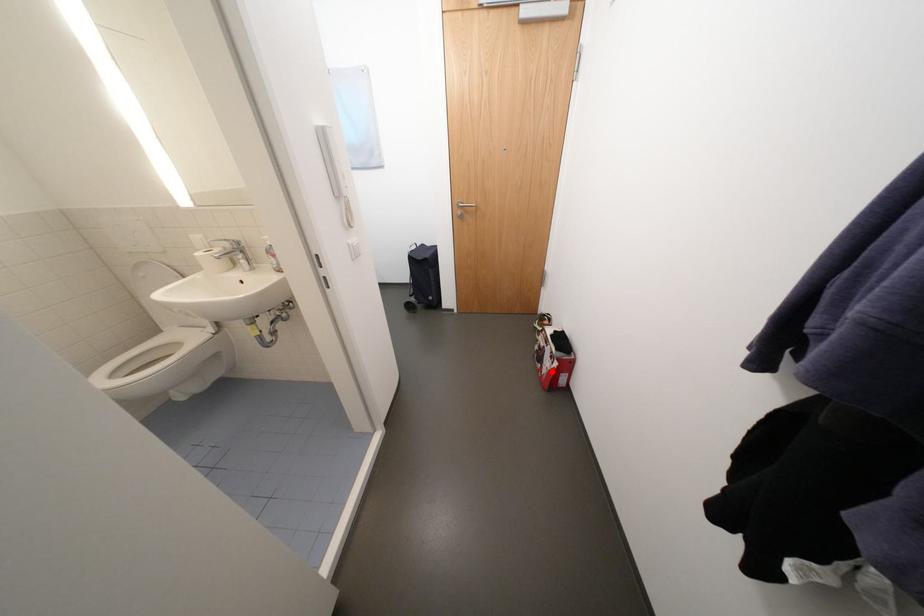
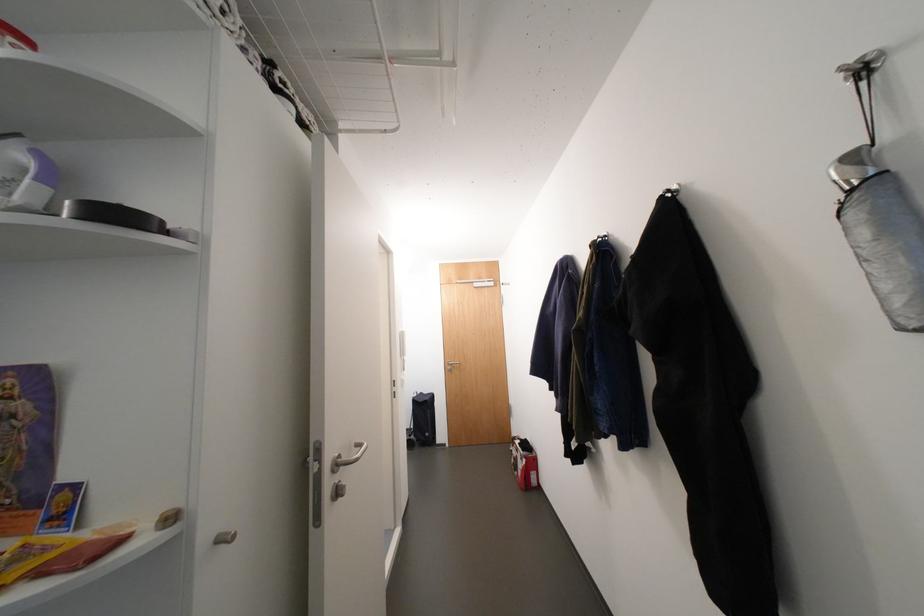
Question: I am providing you with two images of the same scene from different viewpoints. A red point is shown in image1. For the corresponding object point in image2, is it positioned nearer or farther from the camera?

Choices:
 (A) Nearer
 (B) Farther

Answer: (B)